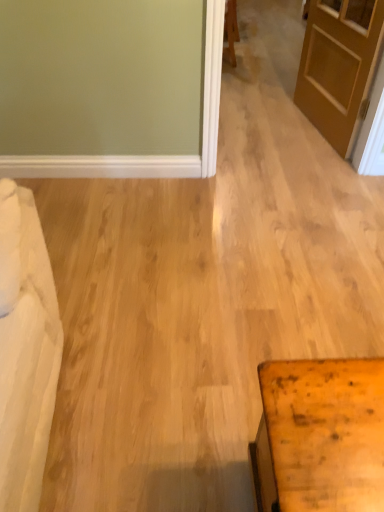
Image resolution: width=384 pixels, height=512 pixels. What are the coordinates of `free space to the left of matte wooden door at upper right` in the screenshot? It's located at (265, 128).